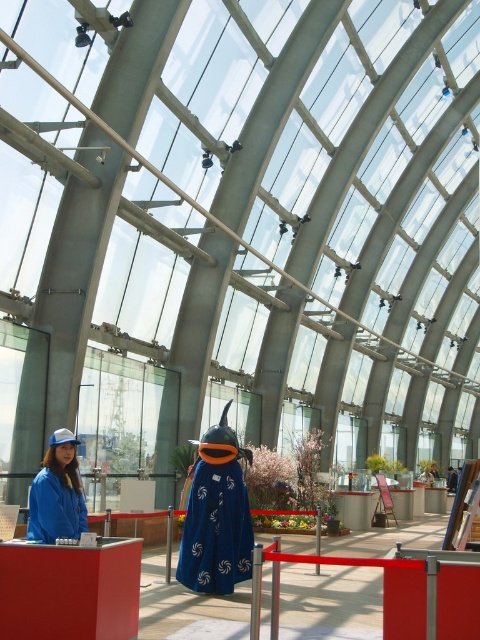
You are a security guard in the building. You need to locate the blue fabric dress at center. Where exactly is it positioned in the scene?

The blue fabric dress at center is located at point coordinates of (216, 529).

You are an event organizer planning to arrange a photoshoot in this space. You want to place the blue fabric dress at center and the blue fabric jacket at lower left in the frame. Which object will appear bigger in the photo?

The blue fabric dress at center will appear bigger in the photo since it has a larger size compared to the blue fabric jacket at lower left.